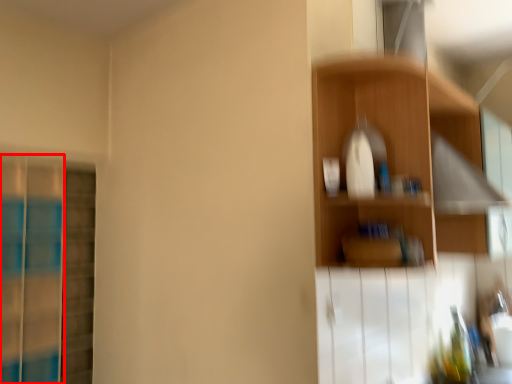
Question: In this image, where is screen door (annotated by the red box) located relative to shelf?

Choices:
 (A) right
 (B) left

Answer: (B)